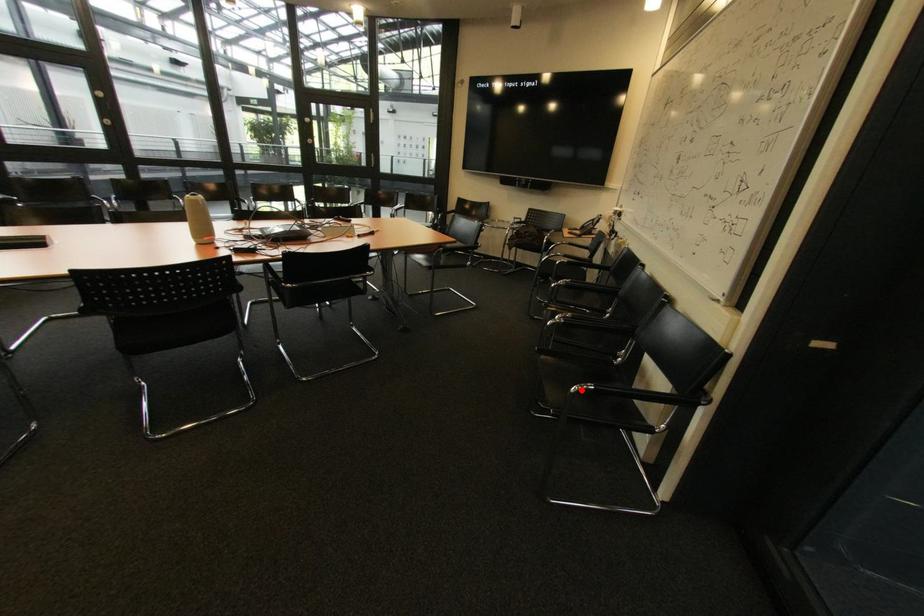
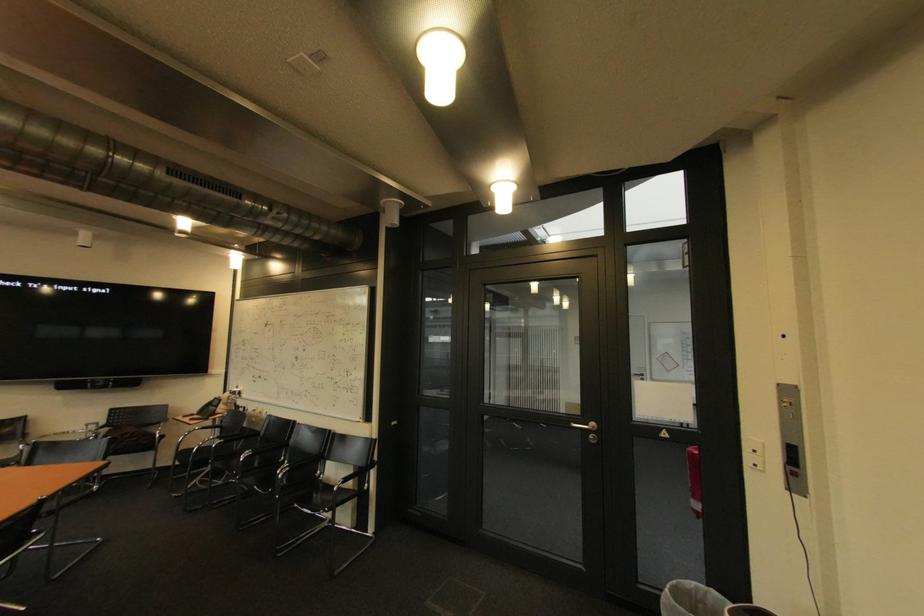
Question: I am providing you with two images of the same scene from different viewpoints. A red point is marked on the first image. Can you still see the location of the red point in image 2?

Choices:
 (A) Yes
 (B) No

Answer: (A)